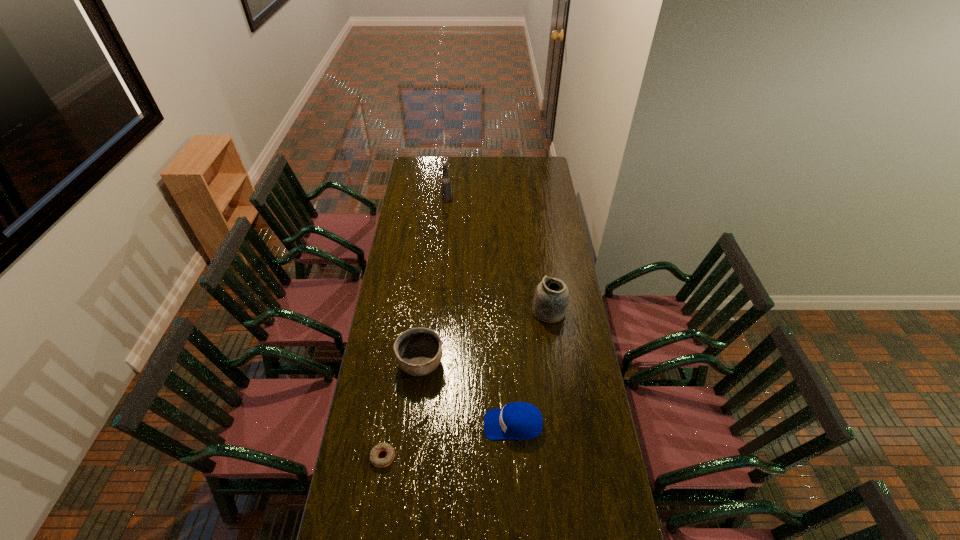
This screenshot has height=540, width=960. In order to click on beer bottle in this screenshot , I will do `click(446, 193)`.

This screenshot has height=540, width=960. I want to click on the second farthest object, so click(551, 299).

Locate an element on the screen. Image resolution: width=960 pixels, height=540 pixels. the fourth shortest object is located at coordinates (551, 299).

Where is `the third shortest object`? the third shortest object is located at coordinates pos(418,351).

The width and height of the screenshot is (960, 540). In order to click on the nearer pottery in this screenshot , I will do `click(418, 351)`.

In order to click on the fourth farthest object in this screenshot , I will do `click(520, 421)`.

Locate an element on the screen. This screenshot has width=960, height=540. the second object from right to left is located at coordinates (520, 421).

Where is `the nearest object`? The image size is (960, 540). the nearest object is located at coordinates (375, 460).

At what (x,y) coordinates should I click in order to perform the action: click on the shortest object. Please return your answer as a coordinate pair (x, y). Image resolution: width=960 pixels, height=540 pixels. Looking at the image, I should click on (375, 460).

The height and width of the screenshot is (540, 960). I want to click on blank area located 0.380m on the side of the beer bottle with the label, so click(516, 199).